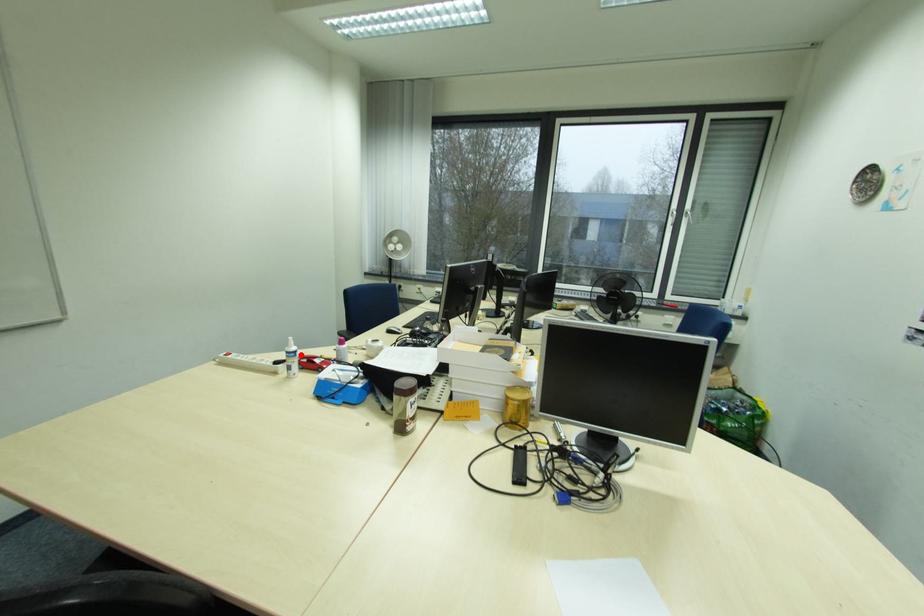
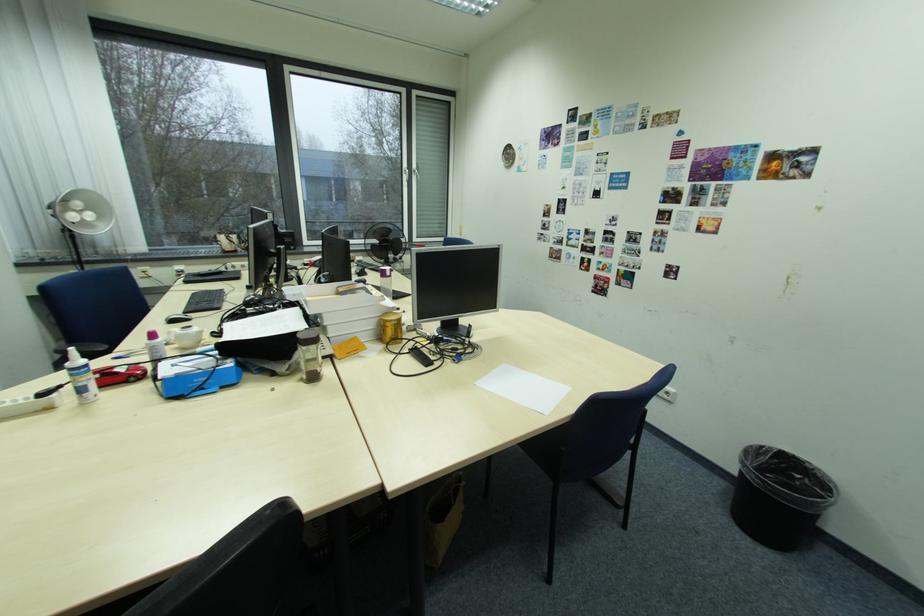
In the second image, find the point that corresponds to the highlighted location in the first image.

(94, 370)